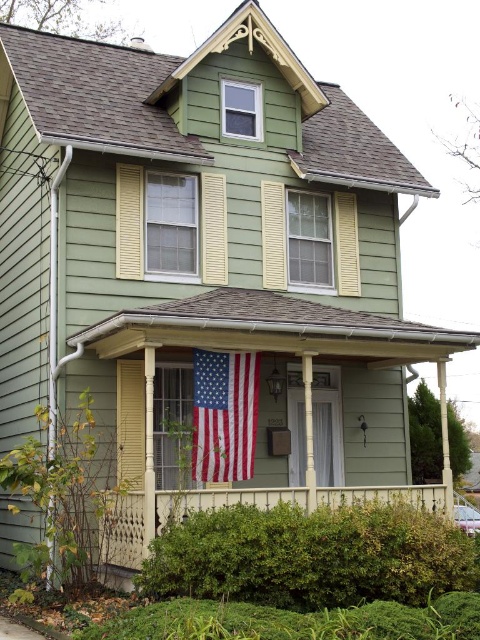
Is the position of white painted wood porch at lower center more distant than that of american flag at center?

That is False.

Does white painted wood porch at lower center have a larger size compared to american flag at center?

Yes, white painted wood porch at lower center is bigger than american flag at center.

Describe the element at coordinates (173, 516) in the screenshot. I see `white painted wood porch at lower center` at that location.

Locate an element on the screen. The height and width of the screenshot is (640, 480). white painted wood porch at lower center is located at coordinates (173, 516).

Can you confirm if matte green porch at center is positioned below white painted wood porch at lower center?

No, matte green porch at center is not below white painted wood porch at lower center.

Between point (442, 372) and point (156, 508), which one is positioned behind?

The point (442, 372) is behind.

The image size is (480, 640). Describe the element at coordinates (259, 401) in the screenshot. I see `matte green porch at center` at that location.

What are the coordinates of `matte green porch at center` in the screenshot? It's located at (259, 401).

Can you confirm if matte green porch at center is bigger than american flag at center?

Yes.

Who is taller, matte green porch at center or american flag at center?

Standing taller between the two is matte green porch at center.

The width and height of the screenshot is (480, 640). In order to click on matte green porch at center in this screenshot , I will do `click(259, 401)`.

Find the location of a particular element. Image resolution: width=480 pixels, height=640 pixels. matte green porch at center is located at coordinates (259, 401).